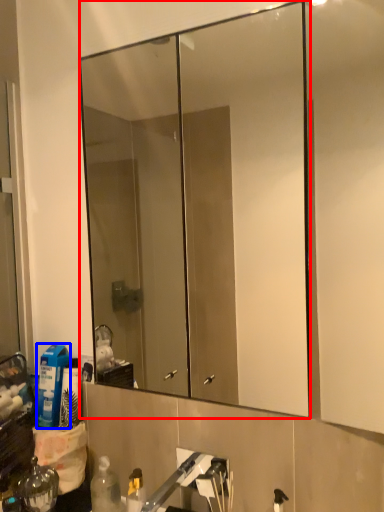
Question: Among these objects, which one is farthest to the camera, mirror (highlighted by a red box) or cleaning product (highlighted by a blue box)?

Choices:
 (A) mirror
 (B) cleaning product

Answer: (B)